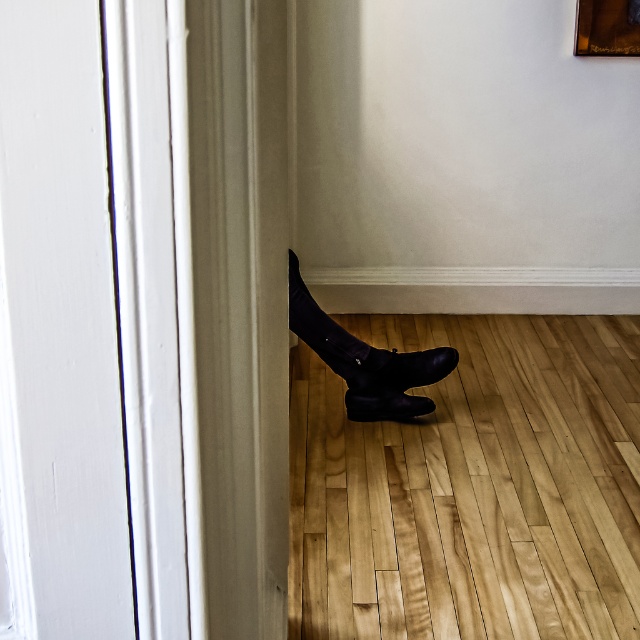
Image resolution: width=640 pixels, height=640 pixels. I want to click on black leather shoe at lower center, so click(x=403, y=369).

Which of these two, black leather shoe at lower center or wooden picture frame at upper right, stands shorter?

black leather shoe at lower center

Identify the location of black leather shoe at lower center. (403, 369).

Between point (454, 355) and point (576, 29), which one is positioned behind?

The point (576, 29) is more distant.

Between black suede boot at lower right and wooden picture frame at upper right, which one appears on the right side from the viewer's perspective?

Positioned to the right is wooden picture frame at upper right.

What do you see at coordinates (358, 346) in the screenshot?
I see `black suede boot at lower right` at bounding box center [358, 346].

Where is `black suede boot at lower right`? The width and height of the screenshot is (640, 640). black suede boot at lower right is located at coordinates (358, 346).

Is point (340, 368) positioned in front of point (385, 416)?

Yes.

Can you confirm if black suede boot at lower right is shorter than black suede boot at lower center?

No, black suede boot at lower right is not shorter than black suede boot at lower center.

Measure the distance between black suede boot at lower right and camera.

black suede boot at lower right and camera are 7.79 feet apart.

This screenshot has width=640, height=640. I want to click on black suede boot at lower right, so click(x=358, y=346).